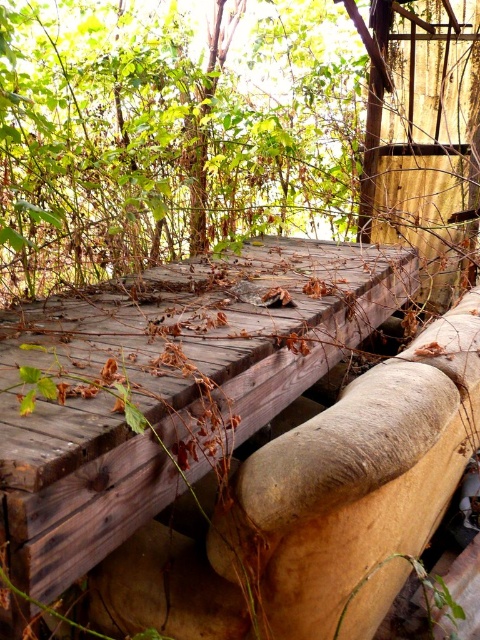
You are standing at the wooden structure and want to walk towards the point labeled as point [239,372]. There is another point marked as point [19,35]. Which point will you encounter first while moving forward?

You will encounter point [239,372] first because it is in front of point [19,35] according to their spatial arrangement.

You are standing at the camera position and want to take a photo of the green leafy tree at upper center. If your camera has a maximum focus range of 8 feet, will you be able to focus on the tree?

The green leafy tree at upper center and camera are 8.22 feet apart from each other. Since the distance exceeds the camera maximum focus range of 8 feet, you will not be able to focus on the tree.